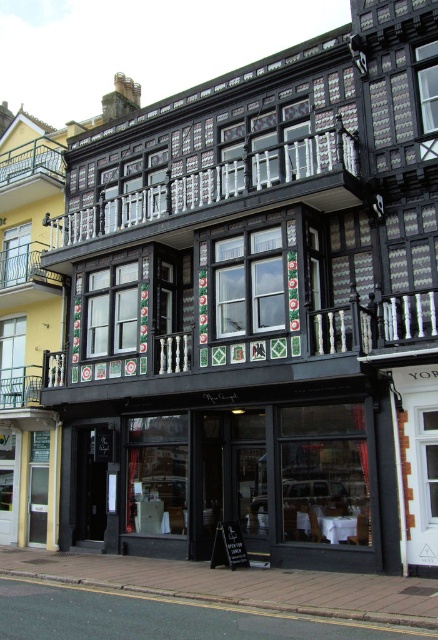
Question: Considering the relative positions of black glass storefront at center and matte black building at center in the image provided, where is black glass storefront at center located with respect to matte black building at center?

Choices:
 (A) above
 (B) below

Answer: (B)

Question: Is black glass storefront at center positioned in front of matte black building at center?

Choices:
 (A) no
 (B) yes

Answer: (B)

Question: Which object is closer to the camera taking this photo?

Choices:
 (A) matte black building at center
 (B) black glass storefront at center

Answer: (B)

Question: Is black glass storefront at center below matte black building at center?

Choices:
 (A) yes
 (B) no

Answer: (A)